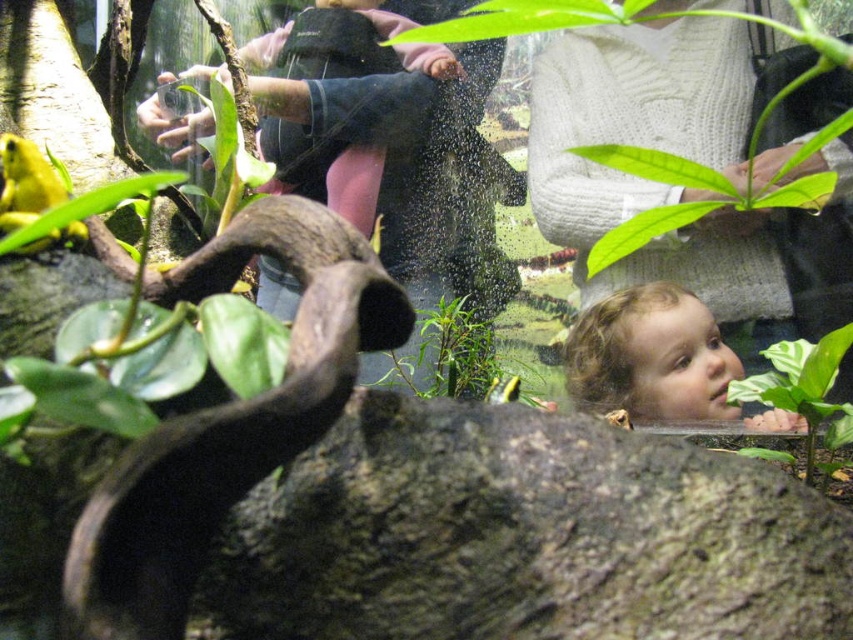
Question: Which point is closer to the camera taking this photo?

Choices:
 (A) (776, 396)
 (B) (305, 209)
 (C) (664, 400)

Answer: (B)

Question: Is brown matte snake at left above green leafy plant at lower right?

Choices:
 (A) yes
 (B) no

Answer: (A)

Question: Can you confirm if brown matte snake at left is positioned above green leafy plant at lower right?

Choices:
 (A) yes
 (B) no

Answer: (A)

Question: Which is farther from the light brown hair at center?

Choices:
 (A) green leafy plant at lower right
 (B) matte pink sweater at upper center
 (C) brown matte snake at left

Answer: (C)

Question: Does brown matte snake at left have a smaller size compared to light brown hair at center?

Choices:
 (A) yes
 (B) no

Answer: (A)

Question: Based on their relative distances, which object is nearer to the light brown hair at center?

Choices:
 (A) green leafy plant at lower right
 (B) matte pink sweater at upper center
 (C) brown matte snake at left

Answer: (A)